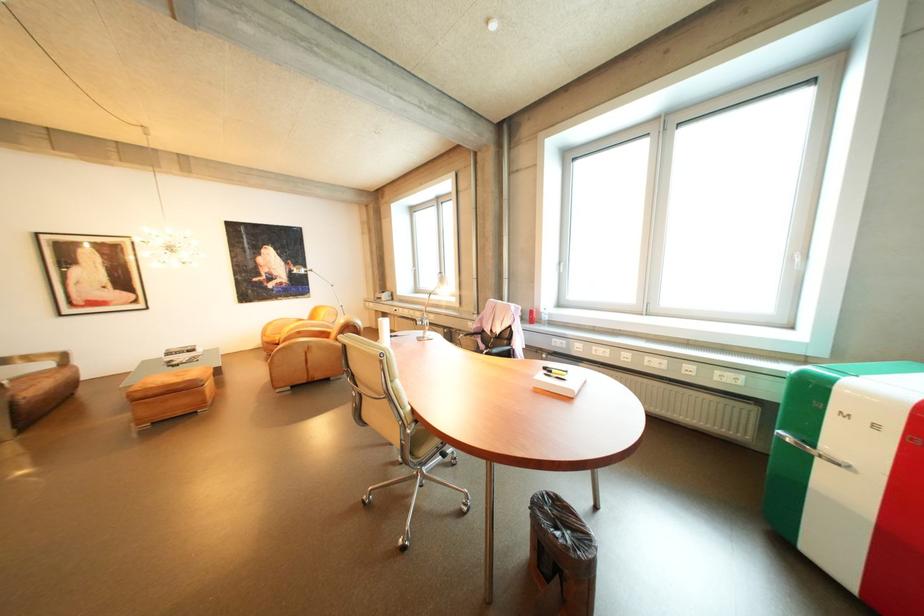
Find the location of a particular element. The image size is (924, 616). chair sitting surface is located at coordinates (27, 379).